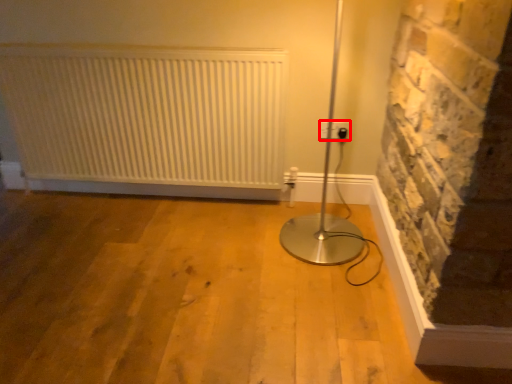
Question: From the image's perspective, what is the correct spatial relationship of electric outlet (annotated by the red box) in relation to radiator?

Choices:
 (A) above
 (B) below

Answer: (B)